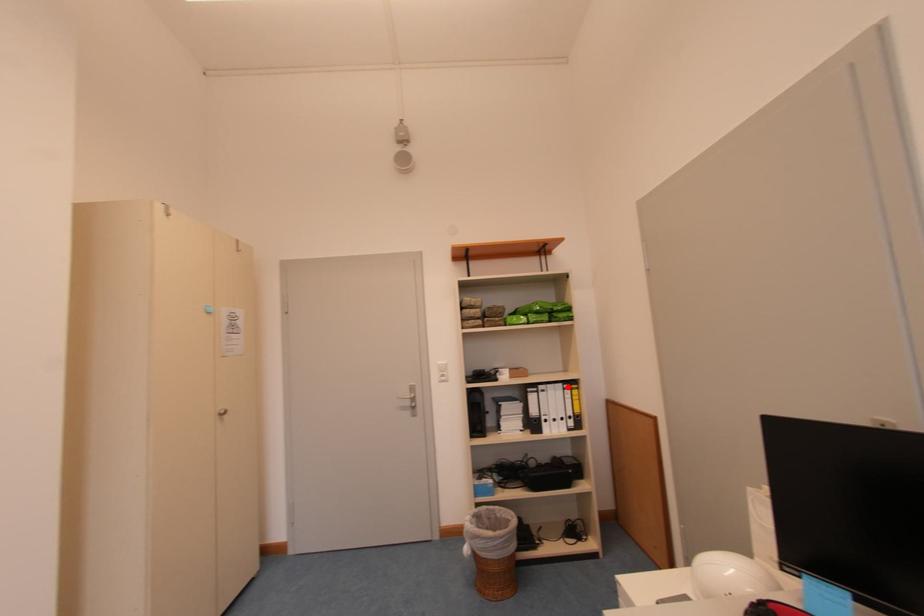
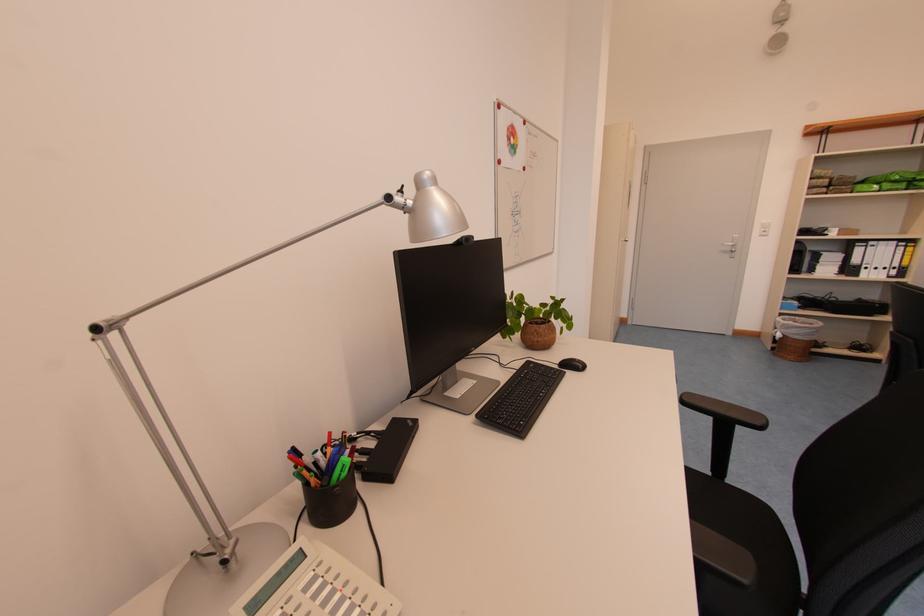
In the second image, find the point that corresponds to the highlighted location in the first image.

(903, 245)